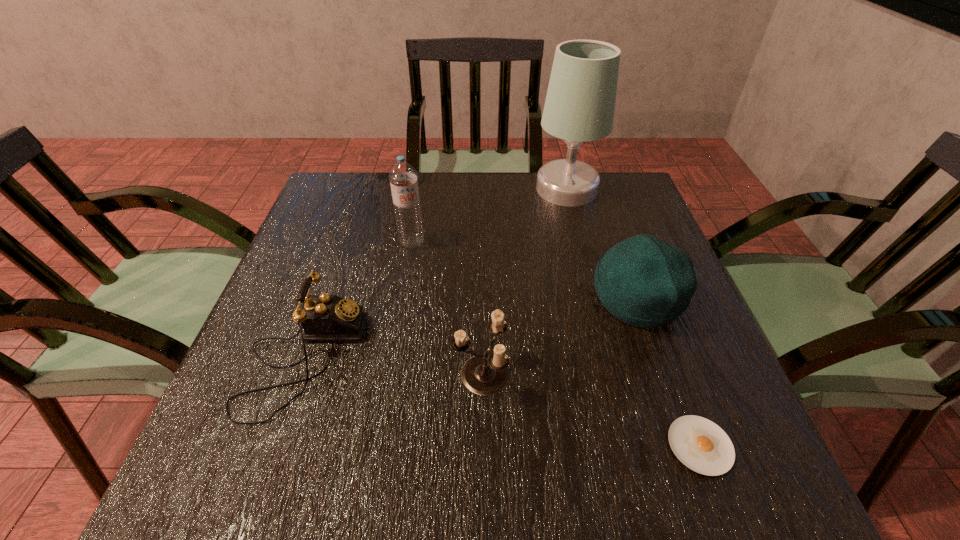
Where is `lampshade`? lampshade is located at coordinates (580, 103).

Locate an element on the screen. the tallest object is located at coordinates (580, 103).

Where is `the fifth shortest object`? This screenshot has width=960, height=540. the fifth shortest object is located at coordinates (403, 177).

Locate an element on the screen. This screenshot has width=960, height=540. water bottle is located at coordinates (403, 177).

Where is `beanie`? beanie is located at coordinates (643, 281).

Identify the location of the third object from left to right. This screenshot has height=540, width=960. (485, 374).

Identify the location of telephone. (324, 317).

Where is `egg yolk`? egg yolk is located at coordinates (700, 444).

Identify the location of vacant space located 0.110m on the base of the lampshade. (496, 189).

Locate an element on the screen. The height and width of the screenshot is (540, 960). vacant space located on the base of the lampshade is located at coordinates (404, 189).